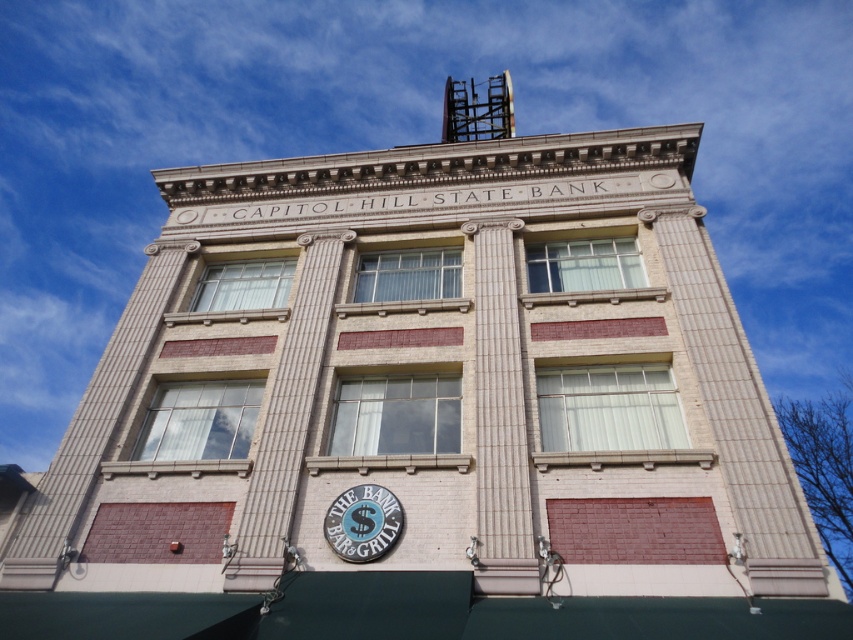
Looking at this image, does smooth stone column at center appear under white marble pillar at center?

No.

Is smooth stone column at center closer to camera compared to white marble pillar at center?

Yes, smooth stone column at center is in front of white marble pillar at center.

This screenshot has width=853, height=640. What do you see at coordinates (500, 417) in the screenshot? I see `smooth stone column at center` at bounding box center [500, 417].

You are a GUI agent. You are given a task and a screenshot of the screen. Output one action in this format:
    pyautogui.click(x=<x>, y=<y>)
    Task: Click on the smooth stone column at center
    
    Given the screenshot: What is the action you would take?
    pyautogui.click(x=500, y=417)

Is white marble pillar at center wider than blue metallic sign at lower center?

Indeed, white marble pillar at center has a greater width compared to blue metallic sign at lower center.

Who is positioned more to the right, white marble pillar at center or blue metallic sign at lower center?

From the viewer's perspective, blue metallic sign at lower center appears more on the right side.

This screenshot has width=853, height=640. Find the location of `white marble pillar at center`. white marble pillar at center is located at coordinates (286, 419).

Is smooth stone column at center wider than blue metallic sign at lower center?

Correct, the width of smooth stone column at center exceeds that of blue metallic sign at lower center.

Can you confirm if smooth stone column at center is positioned below blue metallic sign at lower center?

No.

You are a GUI agent. You are given a task and a screenshot of the screen. Output one action in this format:
    pyautogui.click(x=<x>, y=<y>)
    Task: Click on the smooth stone column at center
    The height and width of the screenshot is (640, 853).
    Given the screenshot: What is the action you would take?
    pyautogui.click(x=500, y=417)